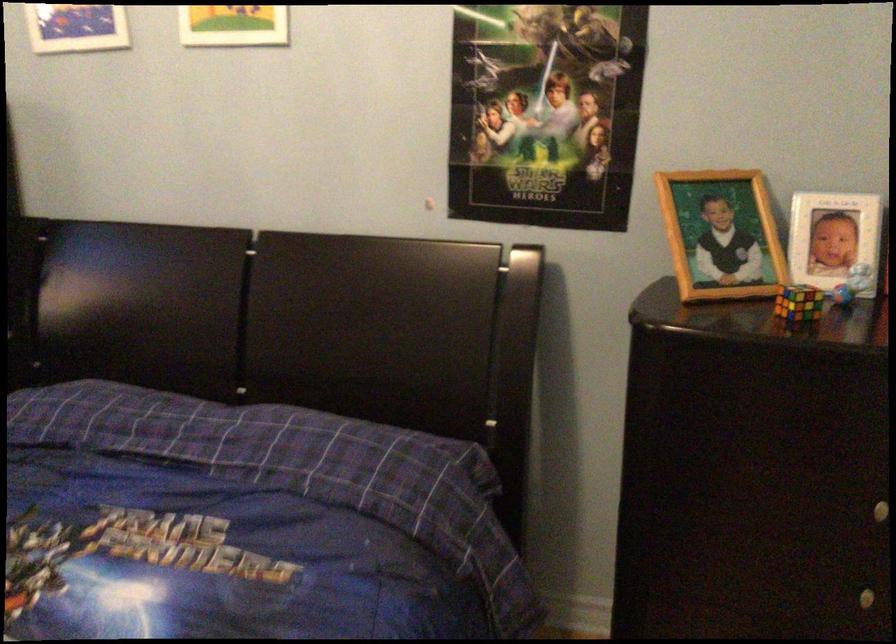
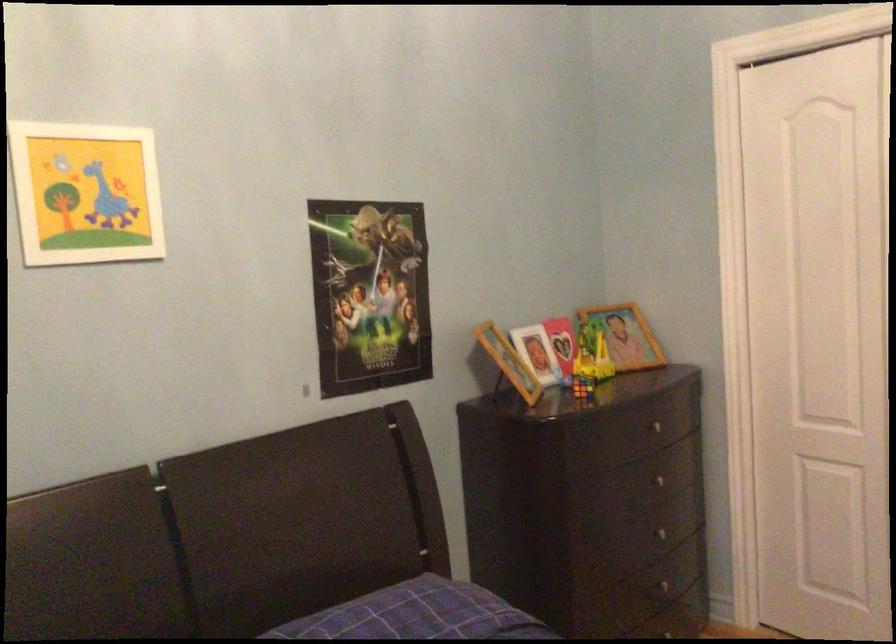
The point at [798,306] is marked in the first image. Where is the corresponding point in the second image?

(582, 386)